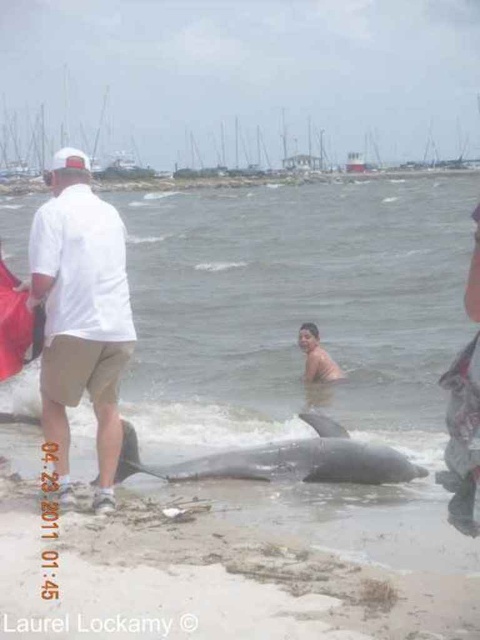
Question: Does white matte shirt at left appear under gray matte whale at center?

Choices:
 (A) yes
 (B) no

Answer: (B)

Question: Which point is farther to the camera?

Choices:
 (A) tan skin human at center
 (B) white matte shirt at left
 (C) gray matte whale at center

Answer: (A)

Question: Among these points, which one is farthest from the camera?

Choices:
 (A) (271, 451)
 (B) (307, 326)
 (C) (120, 288)

Answer: (B)

Question: Does white matte shirt at left have a greater width compared to gray matte whale at center?

Choices:
 (A) yes
 (B) no

Answer: (B)

Question: Does white matte shirt at left appear on the right side of gray matte whale at center?

Choices:
 (A) yes
 (B) no

Answer: (B)

Question: Which of the following is the farthest from the observer?

Choices:
 (A) gray matte whale at center
 (B) tan skin human at center
 (C) white matte shirt at left

Answer: (B)